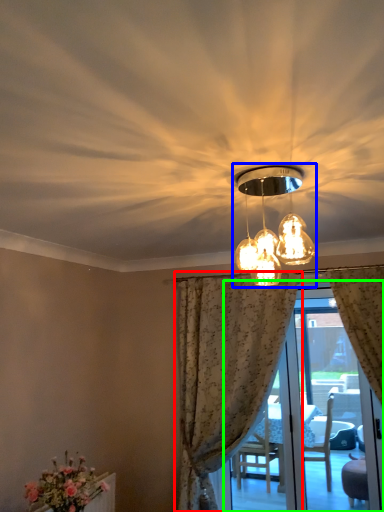
Question: Which is farther away from curtain (highlighted by a red box)? lamp (highlighted by a blue box) or screen door (highlighted by a green box)?

Choices:
 (A) lamp
 (B) screen door

Answer: (A)